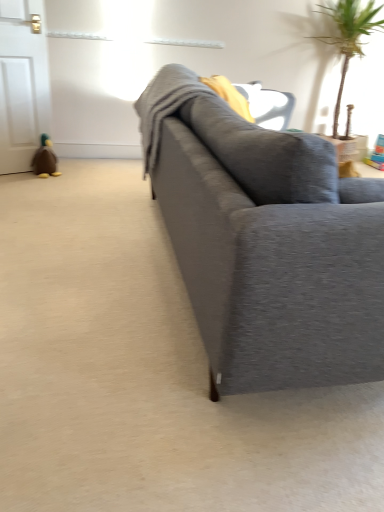
Where is `free space in front of brown plush duck at left`? This screenshot has width=384, height=512. free space in front of brown plush duck at left is located at coordinates (39, 183).